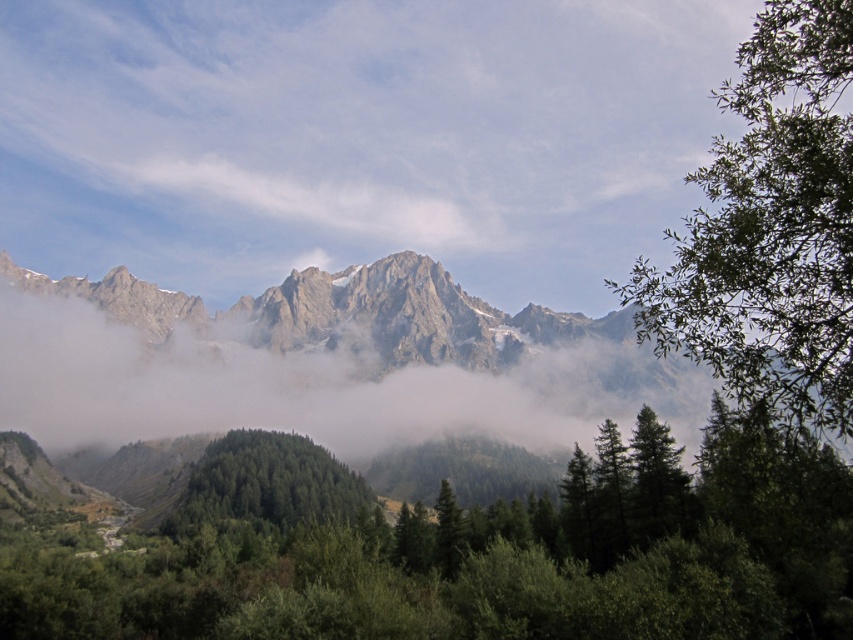
Question: Which object is closer to the camera taking this photo?

Choices:
 (A) rocky gray mountain range at upper center
 (B) green matte tree at center
 (C) green matte tree at right
 (D) green matte forest at center

Answer: (B)

Question: Is green matte tree at center smaller than white fluffy cloud at upper center?

Choices:
 (A) no
 (B) yes

Answer: (A)

Question: Does white fluffy cloud at upper center have a larger size compared to green matte forest at center?

Choices:
 (A) no
 (B) yes

Answer: (B)

Question: Which object appears farthest from the camera in this image?

Choices:
 (A) green matte forest at center
 (B) rocky gray mountain range at upper center
 (C) white fluffy cloud at upper center
 (D) green matte tree at right

Answer: (C)

Question: Which of the following is the closest to the observer?

Choices:
 (A) (476, 230)
 (B) (239, 472)
 (C) (485, 394)
 (D) (809, 420)

Answer: (D)

Question: Is green matte forest at center to the left of green matte tree at right from the viewer's perspective?

Choices:
 (A) yes
 (B) no

Answer: (A)